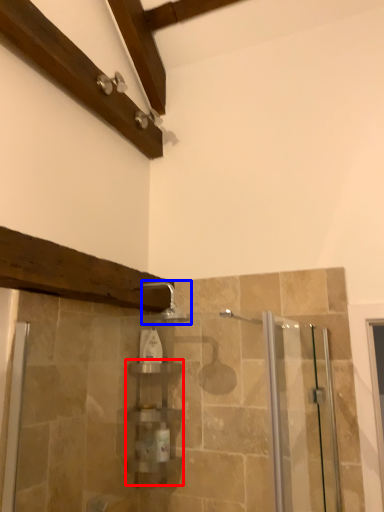
Question: Which object appears farthest to the camera in this image, shelf (highlighted by a red box) or shower (highlighted by a blue box)?

Choices:
 (A) shelf
 (B) shower

Answer: (A)